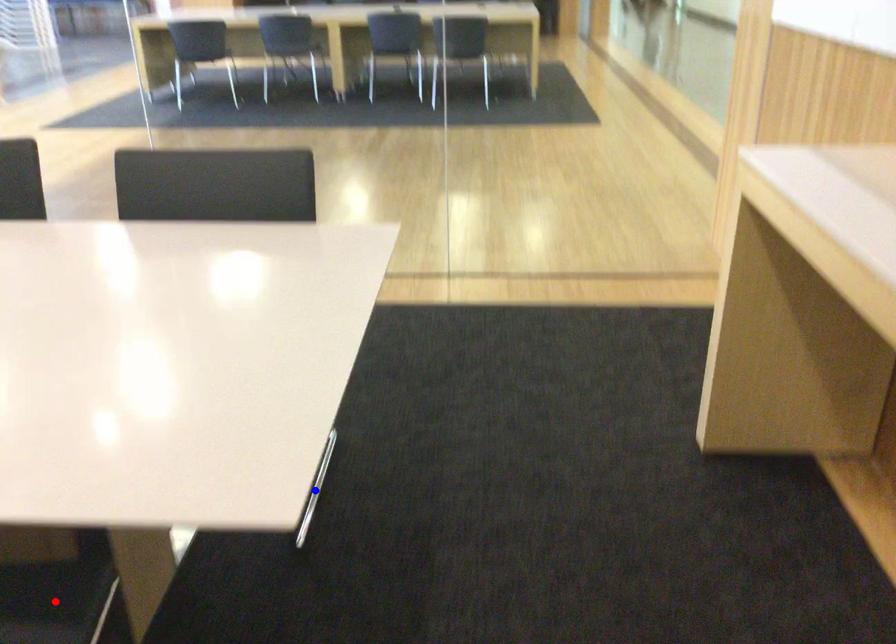
Question: In the image, two points are highlighted. Which point is nearer to the camera? Reply with the corresponding letter.

Choices:
 (A) blue point
 (B) red point

Answer: (B)